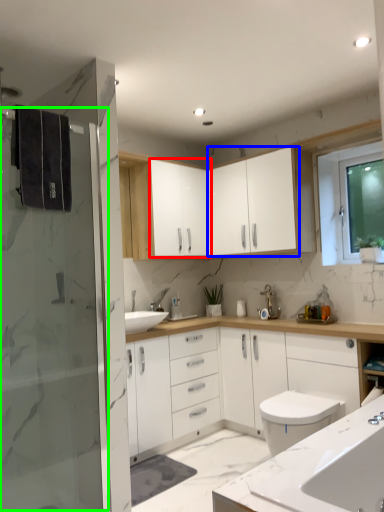
Question: Which object is the farthest from cabinetry (highlighted by a red box)? Choose among these: cabinetry (highlighted by a blue box) or screen door (highlighted by a green box).

Choices:
 (A) cabinetry
 (B) screen door

Answer: (B)